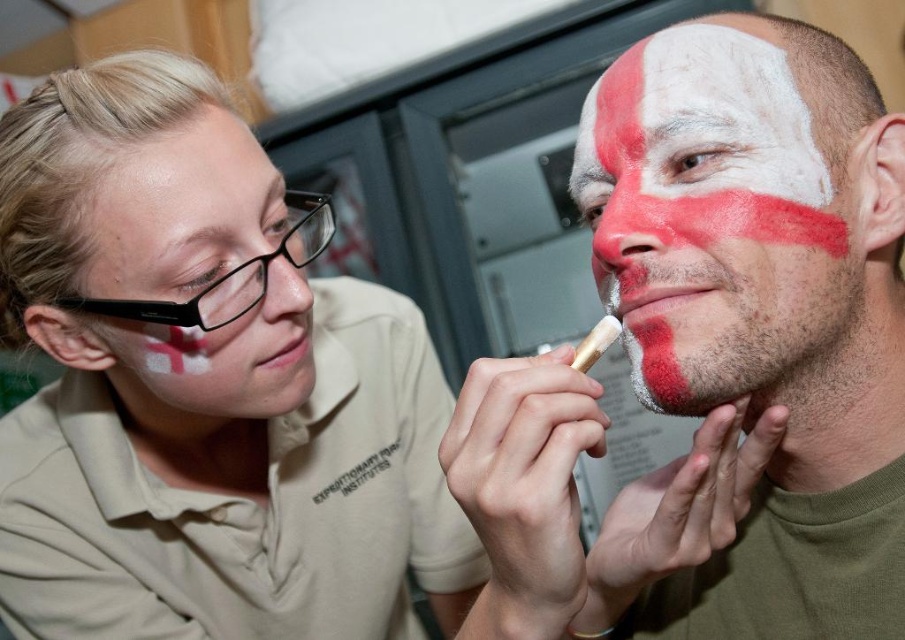
Which is behind, point (634, 253) or point (246, 394)?

Positioned behind is point (246, 394).

Can you confirm if white matte paint at center is positioned below matte white face paint at upper left?

Incorrect, white matte paint at center is not positioned below matte white face paint at upper left.

Identify the location of white matte paint at center. This screenshot has height=640, width=905. (713, 214).

Locate an element on the screen. Image resolution: width=905 pixels, height=640 pixels. white matte paint at center is located at coordinates (713, 214).

Can you confirm if matte beige shirt at upper left is positioned below matte gold paintbrush at lower center?

Yes.

The image size is (905, 640). Identify the location of matte beige shirt at upper left. (201, 388).

Based on the photo, is white matte face paint at center smaller than white matte paint at center?

No, white matte face paint at center is not smaller than white matte paint at center.

Where is `white matte face paint at center`? This screenshot has width=905, height=640. white matte face paint at center is located at coordinates (715, 356).

Where is `white matte face paint at center`? white matte face paint at center is located at coordinates (715, 356).